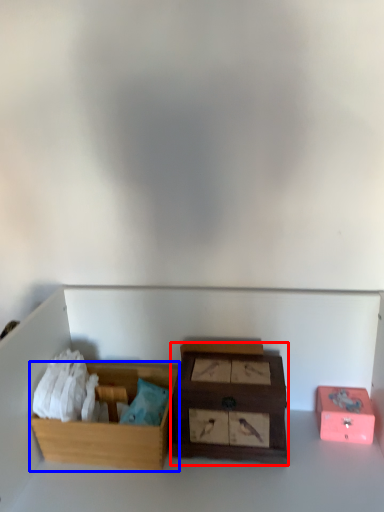
Question: Which of the following is the farthest to the observer, box (highlighted by a red box) or box (highlighted by a blue box)?

Choices:
 (A) box
 (B) box

Answer: (B)